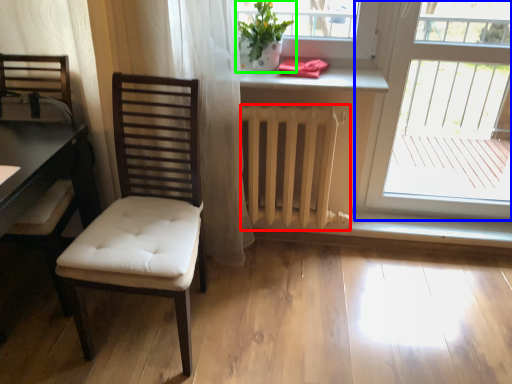
Question: Which is nearer to the radiator (highlighted by a red box)? window (highlighted by a blue box) or houseplant (highlighted by a green box).

Choices:
 (A) window
 (B) houseplant

Answer: (B)